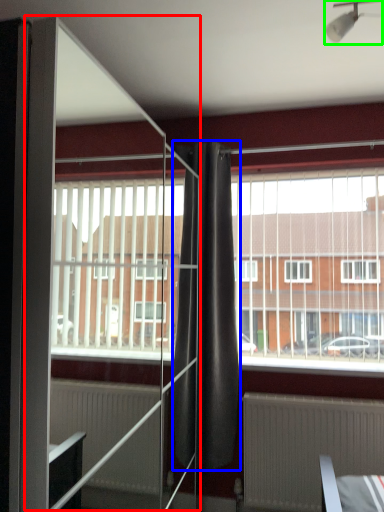
Question: Which object is the closest to the screen door (highlighted by a red box)? Choose among these: curtain (highlighted by a blue box) or light fixture (highlighted by a green box).

Choices:
 (A) curtain
 (B) light fixture

Answer: (A)